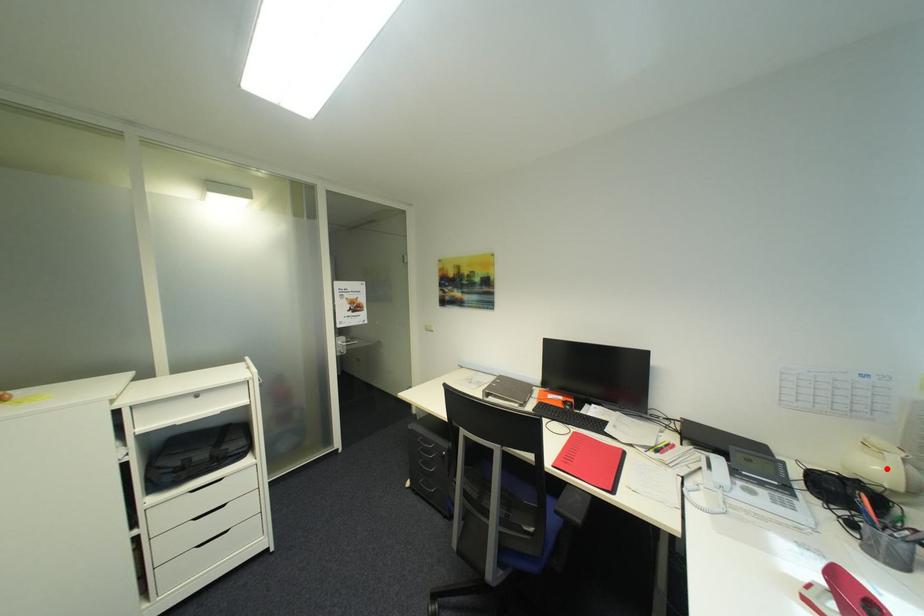
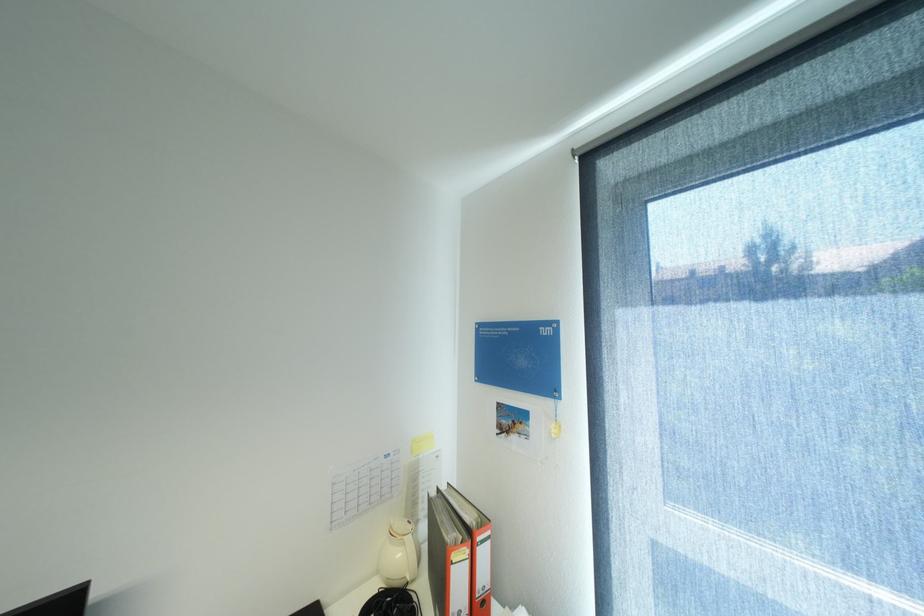
Question: I am providing you with two images of the same scene from different viewpoints. A red point is marked on the first image. Can you still see the location of the red point in image 2?

Choices:
 (A) Yes
 (B) No

Answer: (A)